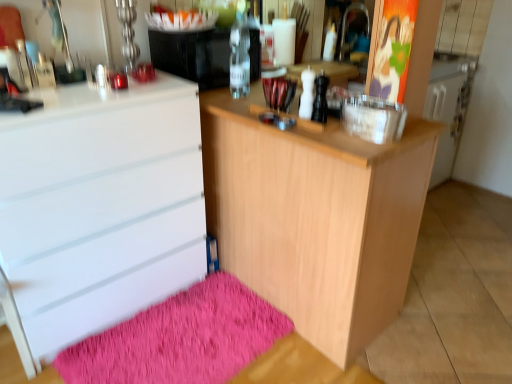
Question: In the image, is light wood cabinet at center positioned in front of or behind shaggy pink bath mat at lower left?

Choices:
 (A) front
 (B) behind

Answer: (A)

Question: Based on their sizes in the image, would you say light wood cabinet at center is bigger or smaller than shaggy pink bath mat at lower left?

Choices:
 (A) small
 (B) big

Answer: (B)

Question: Based on their relative distances, which object is farther from the shaggy pink bath mat at lower left?

Choices:
 (A) light wood cabinet at center
 (B) clear glass bottle at center
 (C) white glossy chest of drawers at left
 (D) clear glass water bottle at center

Answer: (D)

Question: Considering the real-world distances, which object is closest to the clear glass water bottle at center?

Choices:
 (A) light wood cabinet at center
 (B) shaggy pink bath mat at lower left
 (C) clear glass bottle at center
 (D) white glossy chest of drawers at left

Answer: (C)